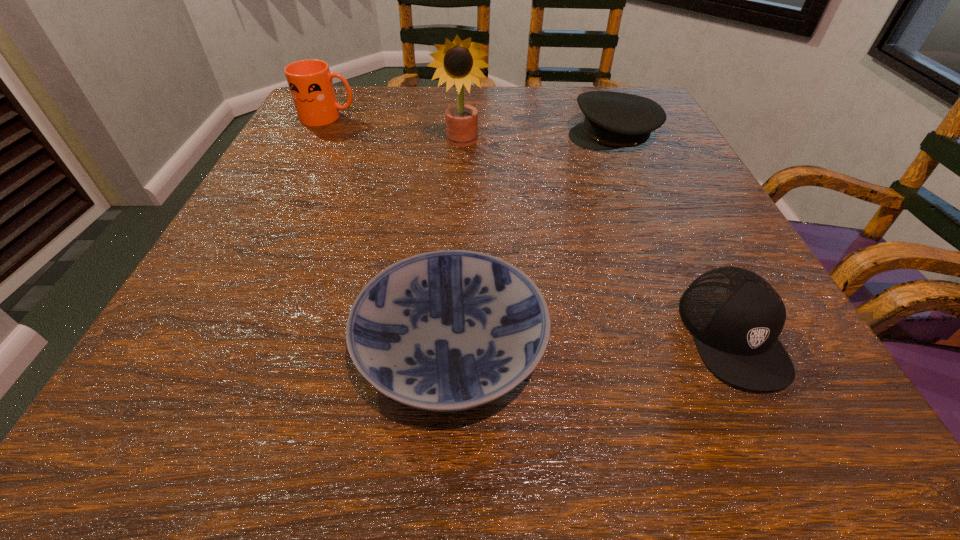
The height and width of the screenshot is (540, 960). What are the coordinates of `sunflower` in the screenshot? It's located at (458, 62).

Find the location of a particular element. mug is located at coordinates (310, 82).

This screenshot has height=540, width=960. I want to click on the leftmost object, so click(x=310, y=82).

The width and height of the screenshot is (960, 540). What are the coordinates of `beret` in the screenshot? It's located at (613, 120).

Locate an element on the screen. The height and width of the screenshot is (540, 960). cap is located at coordinates pos(735,316).

In order to click on plate in this screenshot , I will do `click(452, 330)`.

Where is `free region located 0.050m on the face of the tallest object`? The width and height of the screenshot is (960, 540). free region located 0.050m on the face of the tallest object is located at coordinates (461, 167).

Find the location of a particular element. The height and width of the screenshot is (540, 960). vacant space located on the handle side of the leftmost object is located at coordinates (428, 118).

At what (x,y) coordinates should I click in order to perform the action: click on vacant space located on the front-facing side of the beret. Please return your answer as a coordinate pair (x, y). This screenshot has height=540, width=960. Looking at the image, I should click on (529, 137).

I want to click on vacant space located on the front-facing side of the beret, so click(x=462, y=137).